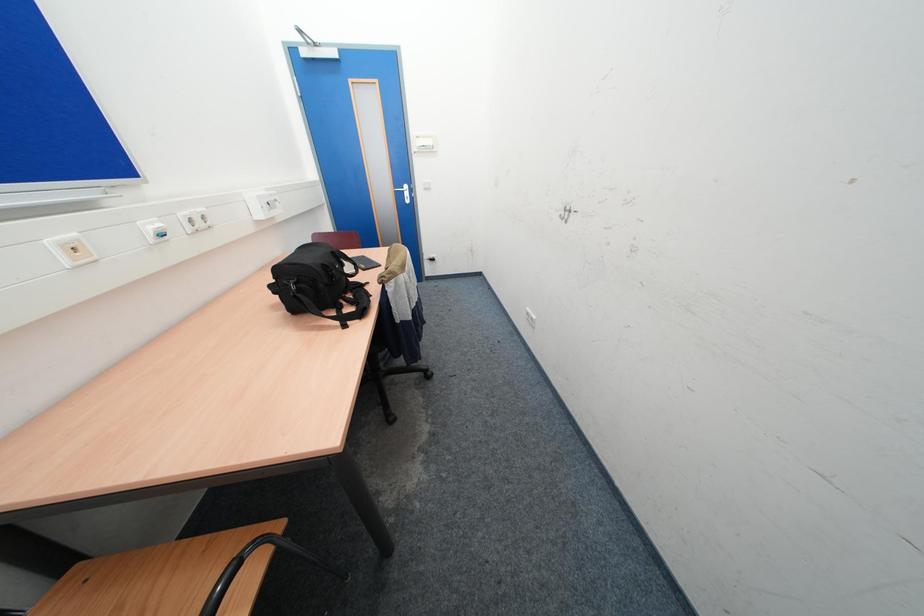
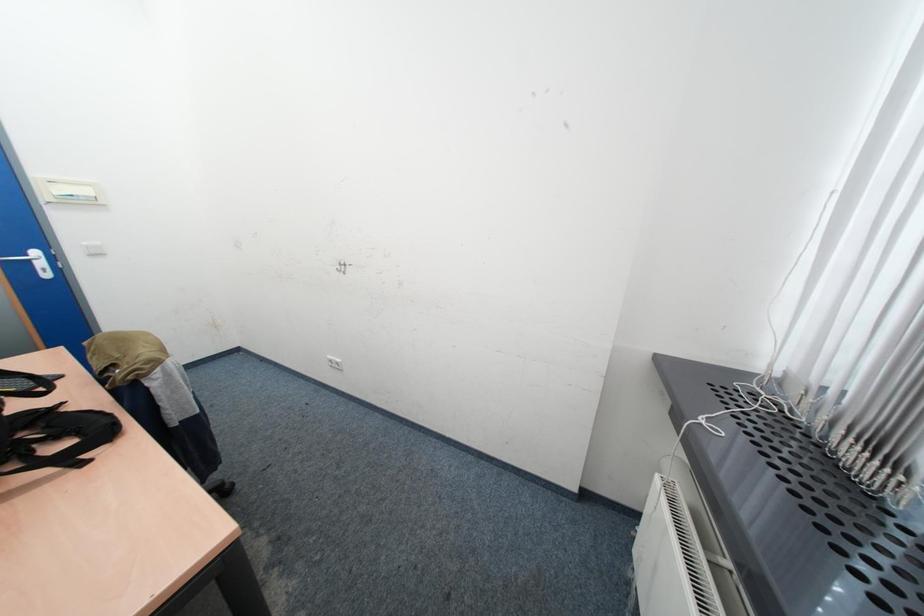
Question: The images are taken continuously from a first-person perspective. In which direction is your viewpoint rotating?

Choices:
 (A) Left
 (B) Right
 (C) Up
 (D) Down

Answer: (B)